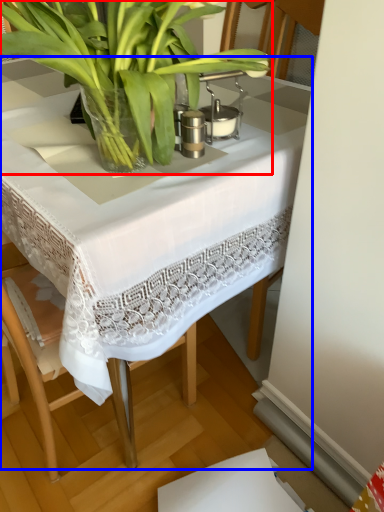
Question: Which object is further to the camera taking this photo, houseplant (highlighted by a red box) or table (highlighted by a blue box)?

Choices:
 (A) houseplant
 (B) table

Answer: (B)